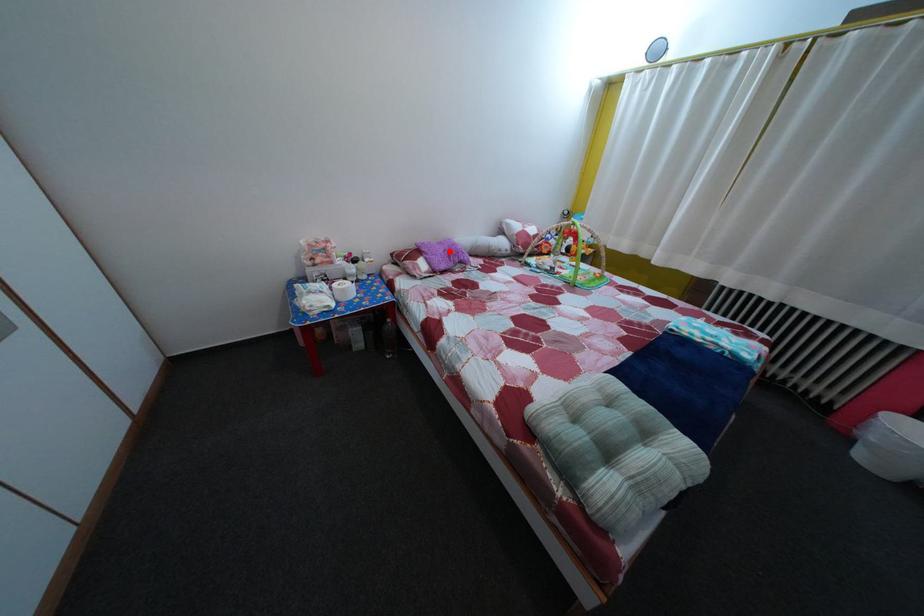
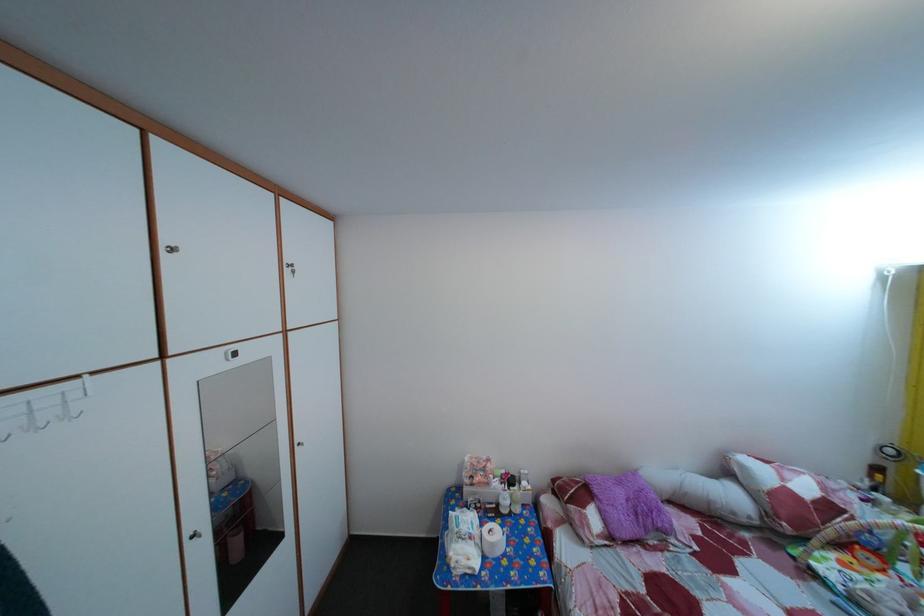
In the second image, find the point that corresponds to the highlighted location in the first image.

(629, 491)